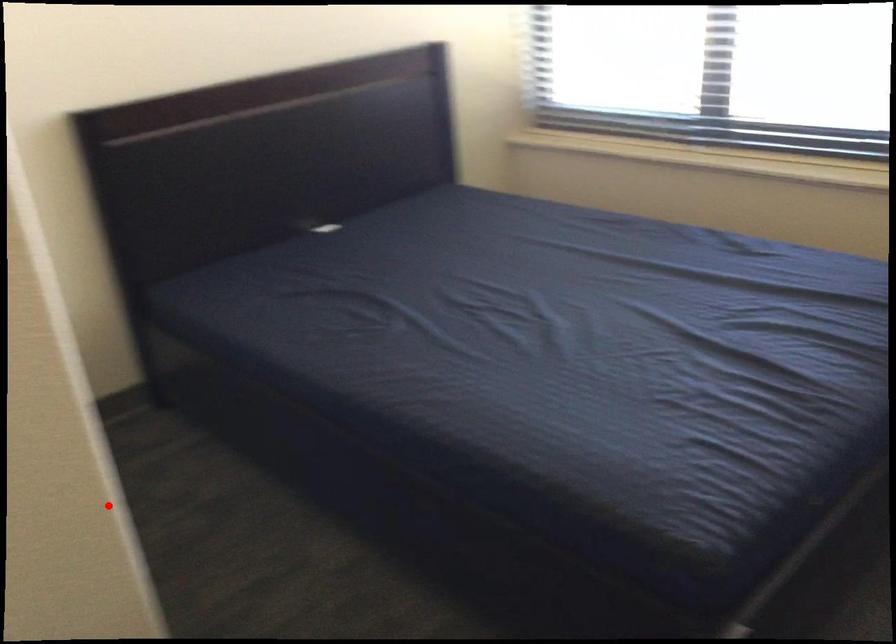
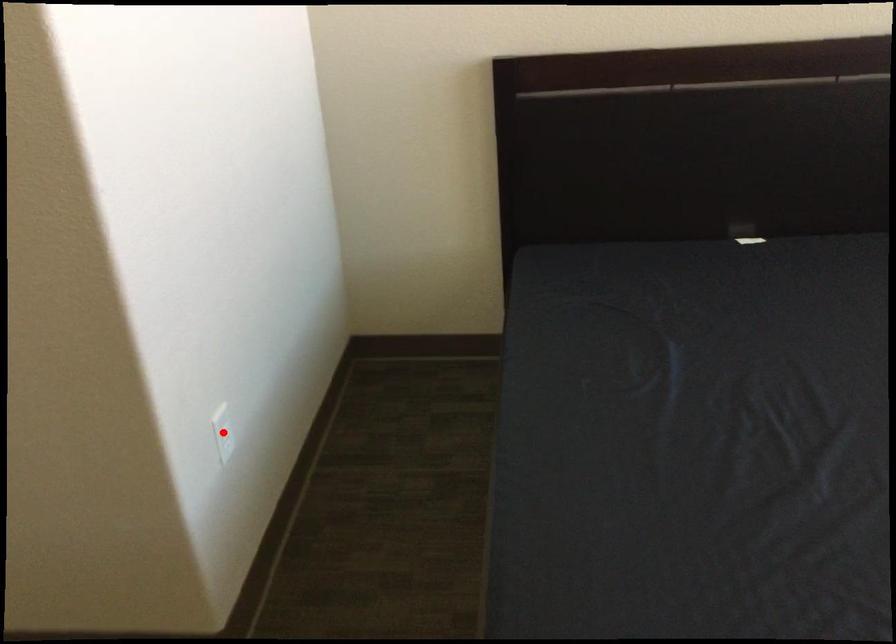
I am providing you with two images of the same scene from different viewpoints. A red point is marked on the first image and another point is marked on the second image. Is the marked point in image1 the same physical position as the marked point in image2?

Yes